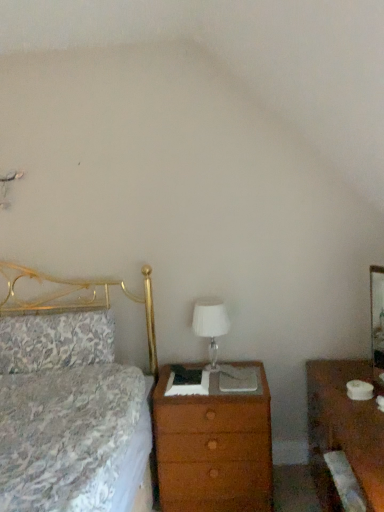
Question: From a real-world perspective, is brown wood nightstand at right beneath floral fabric pillow at left?

Choices:
 (A) no
 (B) yes

Answer: (B)

Question: Does brown wood nightstand at right have a greater width compared to floral fabric pillow at left?

Choices:
 (A) no
 (B) yes

Answer: (B)

Question: Is floral fabric pillow at left at the back of brown wood nightstand at right?

Choices:
 (A) no
 (B) yes

Answer: (A)

Question: From a real-world perspective, is brown wood nightstand at right positioned over floral fabric pillow at left based on gravity?

Choices:
 (A) no
 (B) yes

Answer: (A)

Question: Can you confirm if brown wood nightstand at right is bigger than floral fabric pillow at left?

Choices:
 (A) no
 (B) yes

Answer: (B)

Question: Would you say brown wood nightstand at right is outside floral fabric pillow at left?

Choices:
 (A) no
 (B) yes

Answer: (B)

Question: Can you confirm if wooden chest of drawers at center is shorter than white glass table lamp at center?

Choices:
 (A) no
 (B) yes

Answer: (A)

Question: Is wooden chest of drawers at center smaller than white glass table lamp at center?

Choices:
 (A) yes
 (B) no

Answer: (B)

Question: Considering the relative sizes of wooden chest of drawers at center and white glass table lamp at center in the image provided, is wooden chest of drawers at center taller than white glass table lamp at center?

Choices:
 (A) no
 (B) yes

Answer: (B)

Question: Is wooden chest of drawers at center thinner than white glass table lamp at center?

Choices:
 (A) no
 (B) yes

Answer: (A)

Question: From the image's perspective, is wooden chest of drawers at center under white glass table lamp at center?

Choices:
 (A) yes
 (B) no

Answer: (A)

Question: Is wooden chest of drawers at center to the left of white glass table lamp at center from the viewer's perspective?

Choices:
 (A) yes
 (B) no

Answer: (B)

Question: From a real-world perspective, does floral fabric pillow at left stand above brown wood nightstand at right?

Choices:
 (A) no
 (B) yes

Answer: (B)